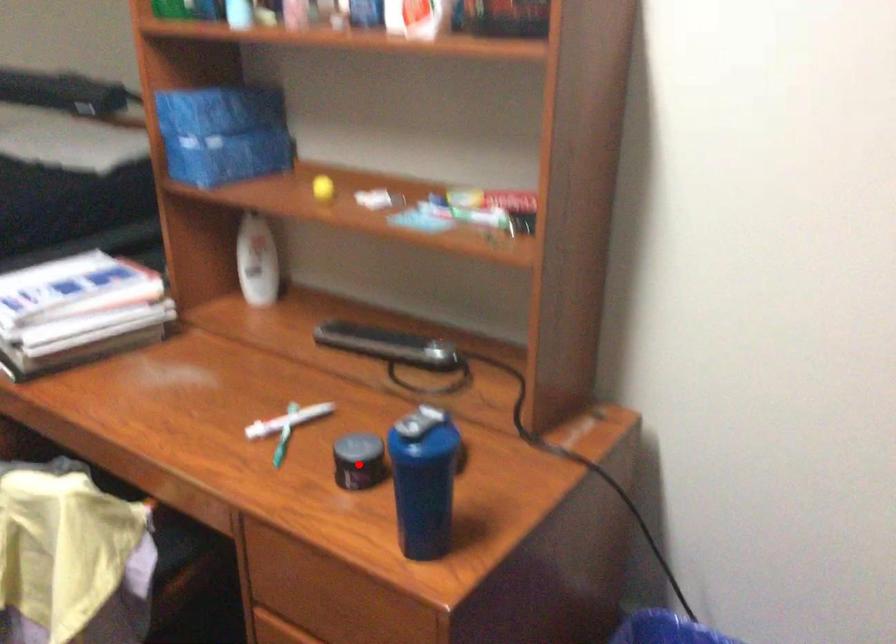
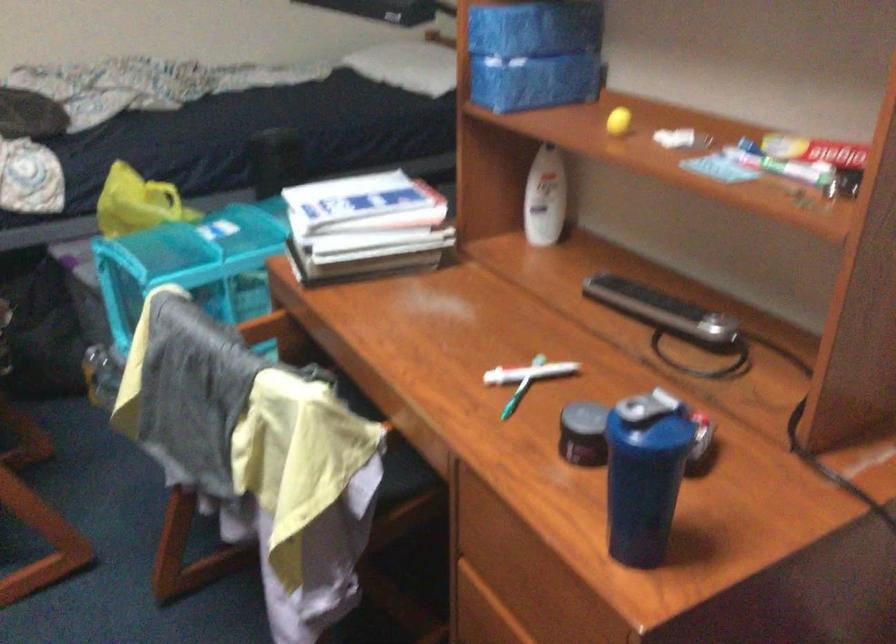
Locate, in the second image, the point that corresponds to the highlighted location in the first image.

(584, 433)